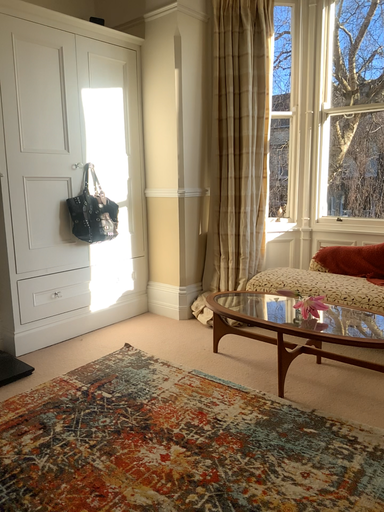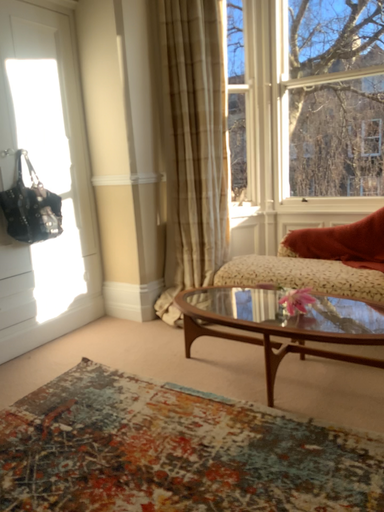
Question: Which way did the camera rotate in the video?

Choices:
 (A) rotated right
 (B) rotated left

Answer: (A)